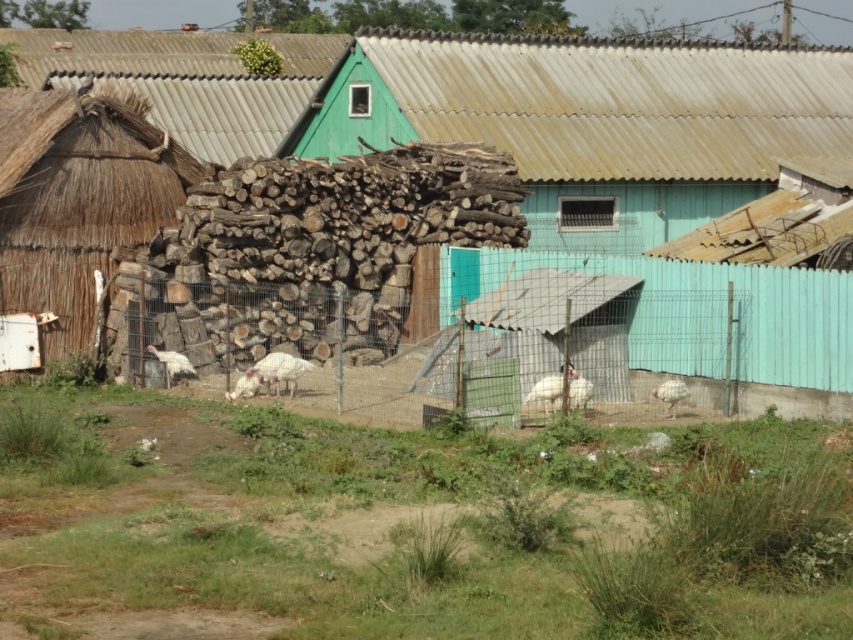
Question: Which of the following is the closest to the observer?

Choices:
 (A) rustic wooden hut at center
 (B) wire mesh fence at center

Answer: (A)

Question: Can you confirm if white feathered turkey at lower left is bigger than white feathered turkey at center?

Choices:
 (A) yes
 (B) no

Answer: (A)

Question: Can you confirm if wire mesh fence at center is positioned above thatched straw hut at left?

Choices:
 (A) yes
 (B) no

Answer: (B)

Question: Which point appears farthest from the camera in this image?

Choices:
 (A) (671, 394)
 (B) (169, 376)
 (C) (119, 115)
 (D) (815, 124)

Answer: (D)

Question: Which point appears farthest from the camera in this image?

Choices:
 (A) (21, 92)
 (B) (154, 355)
 (C) (283, 378)

Answer: (A)

Question: Can you confirm if thatched straw hut at left is positioned to the right of white feathered turkey at lower right?

Choices:
 (A) yes
 (B) no

Answer: (B)